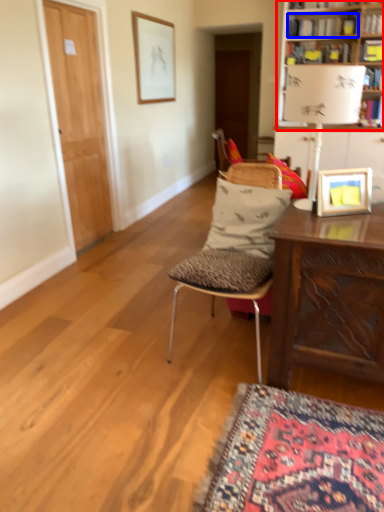
Question: Which of the following is the closest to the observer, bookcase (highlighted by a red box) or book (highlighted by a blue box)?

Choices:
 (A) bookcase
 (B) book

Answer: (A)